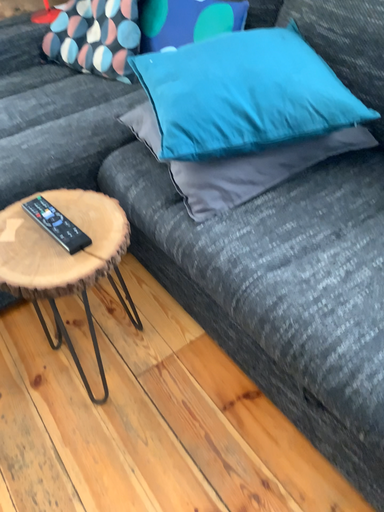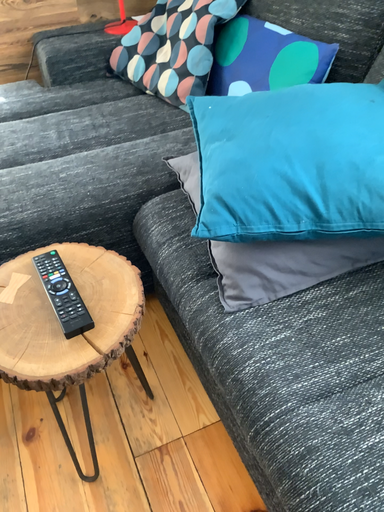
Question: Which way did the camera rotate in the video?

Choices:
 (A) rotated right
 (B) rotated left

Answer: (B)